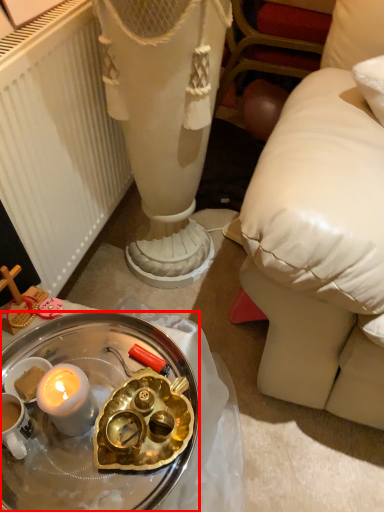
Question: In this image, where is desk (annotated by the red box) located relative to radiator?

Choices:
 (A) left
 (B) right

Answer: (B)